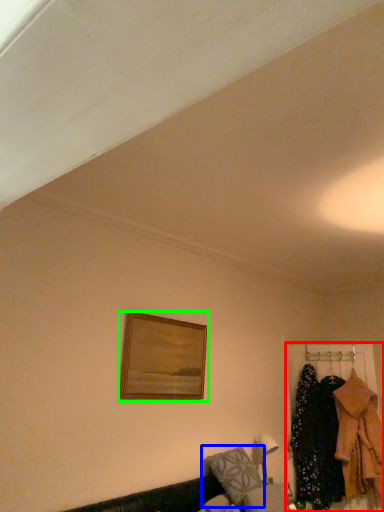
Question: Considering the real-world distances, which object is farthest from closet (highlighted by a red box)? pillow (highlighted by a blue box) or picture frame (highlighted by a green box)?

Choices:
 (A) pillow
 (B) picture frame

Answer: (B)